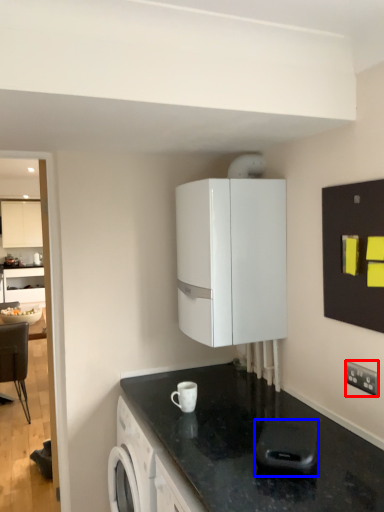
Question: Which object is closer to the camera taking this photo, electric outlet (highlighted by a red box) or appliance (highlighted by a blue box)?

Choices:
 (A) electric outlet
 (B) appliance

Answer: (B)